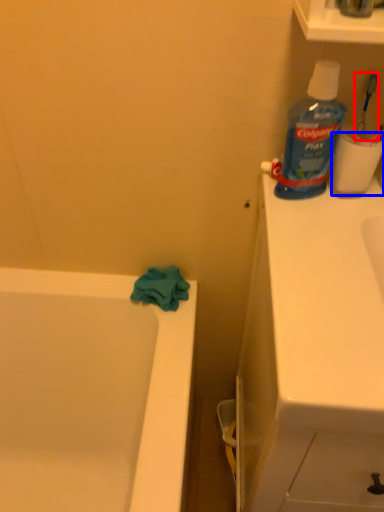
Question: Which of the following is the closest to the observer, toothbrush (highlighted by a red box) or toilet paper (highlighted by a blue box)?

Choices:
 (A) toothbrush
 (B) toilet paper

Answer: (A)